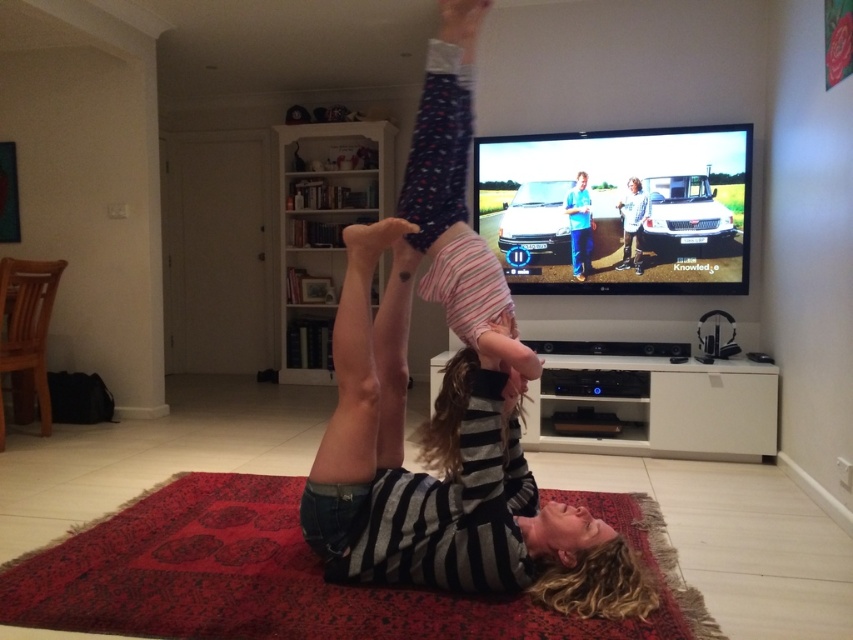
Question: Among these objects, which one is nearest to the camera?

Choices:
 (A) striped cotton shirt at center
 (B) striped fabric person at center
 (C) red carpet at center

Answer: (C)

Question: Among these points, which one is nearest to the camera?

Choices:
 (A) (338, 312)
 (B) (583, 244)
 (C) (316, 628)
 (D) (624, 225)

Answer: (C)

Question: Is red carpet at center positioned before striped cotton shirt at center?

Choices:
 (A) yes
 (B) no

Answer: (A)

Question: Which object is positioned closest to the red carpet at center?

Choices:
 (A) striped fabric person at center
 (B) light blue shirt at upper center

Answer: (A)

Question: Is striped cotton shirt at center above light blue shirt at upper center?

Choices:
 (A) yes
 (B) no

Answer: (B)

Question: Can you confirm if blue jeans at upper center is positioned below light blue shirt at upper center?

Choices:
 (A) yes
 (B) no

Answer: (B)